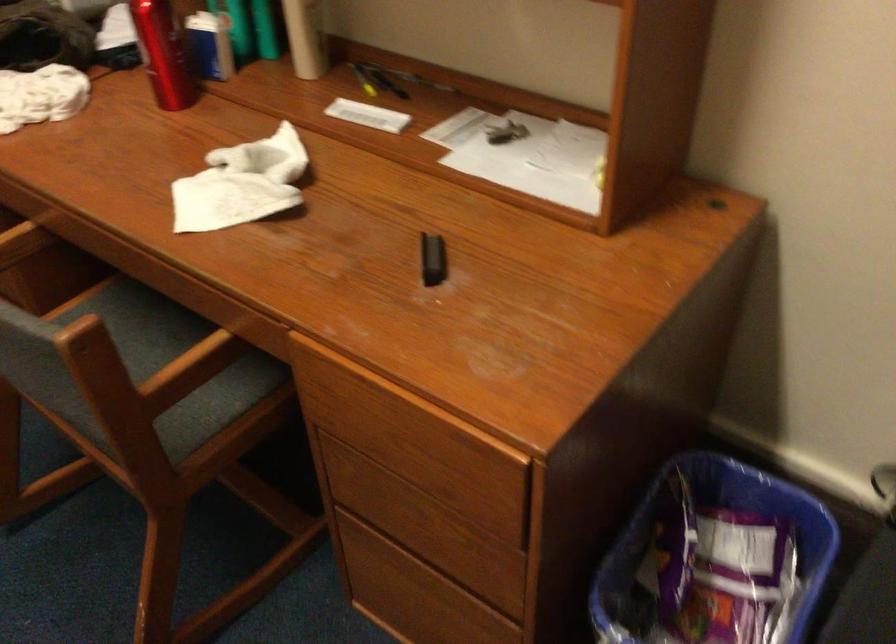
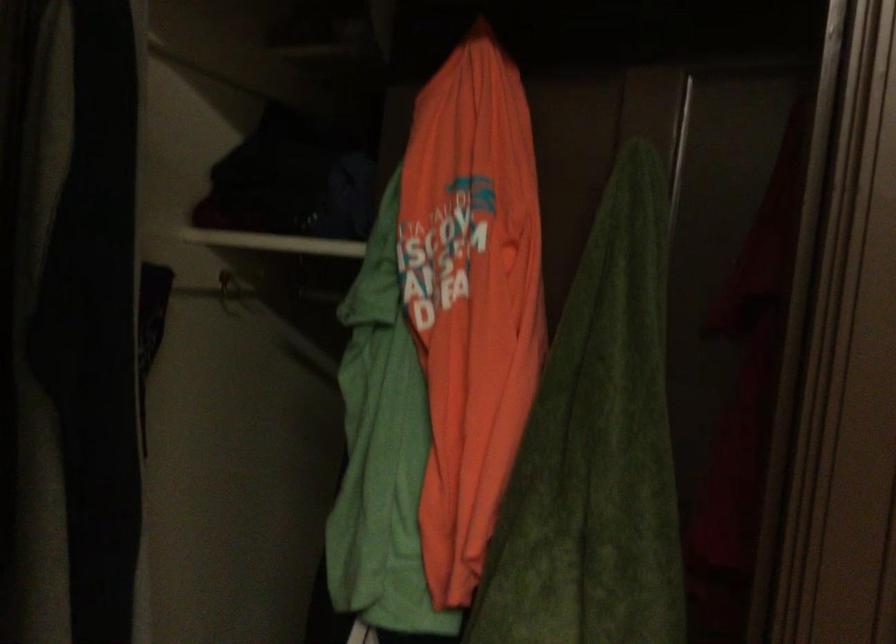
The images are taken continuously from a first-person perspective. In which direction is your viewpoint rotating?

The camera rotated toward right-down.